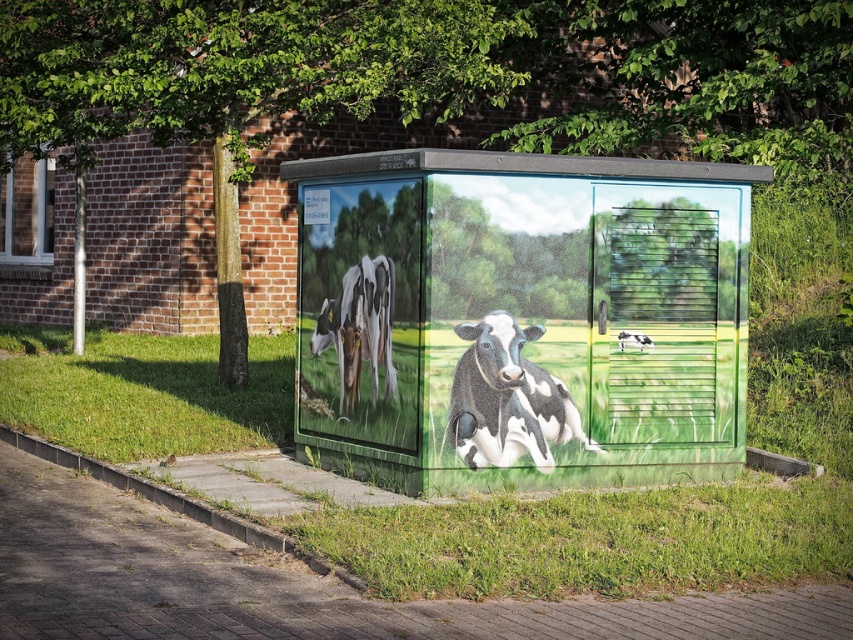
Locate an element on the screen. This screenshot has height=640, width=853. black-and-white cow at center is located at coordinates (508, 397).

What do you see at coordinates (508, 397) in the screenshot? I see `black-and-white cow at center` at bounding box center [508, 397].

Is point (567, 428) positioned behind point (646, 342)?

That is False.

Identify the location of black-and-white cow at center. The width and height of the screenshot is (853, 640). (508, 397).

Between matte glass box at center and black and white cow at center, which one has less height?

black and white cow at center is shorter.

Which is in front, point (440, 432) or point (619, 339)?

Positioned in front is point (440, 432).

This screenshot has height=640, width=853. Describe the element at coordinates (520, 317) in the screenshot. I see `matte glass box at center` at that location.

The width and height of the screenshot is (853, 640). In order to click on matte glass box at center in this screenshot , I will do `click(520, 317)`.

Is point (669, 474) positioned after point (380, 284)?

Yes, point (669, 474) is farther from viewer.

Locate an element on the screen. This screenshot has width=853, height=640. matte glass box at center is located at coordinates (520, 317).